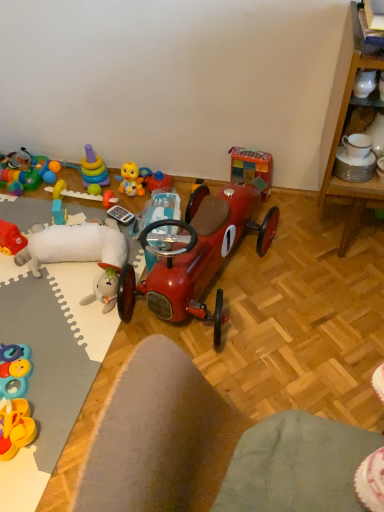
The width and height of the screenshot is (384, 512). I want to click on vacant space in between wooden cabinet at right and matte plastic desk at center, so [x=313, y=332].